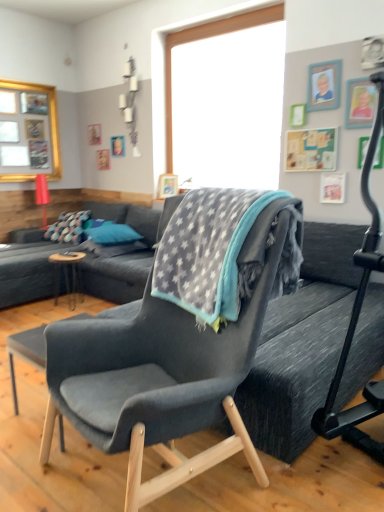
Question: Is gray fleece blanket at center to the left or to the right of brown wooden table at center in the image?

Choices:
 (A) right
 (B) left

Answer: (A)

Question: From the image's perspective, is gray fleece blanket at center positioned above or below brown wooden table at center?

Choices:
 (A) below
 (B) above

Answer: (B)

Question: Which of these objects is positioned farthest from the black rubber baby carriage at right?

Choices:
 (A) blue fabric pillow at center
 (B) dark gray fabric couch at left
 (C) velvet dark blue armchair at center
 (D) gray fleece blanket at center
 (E) gold-framed picture at upper left

Answer: (E)

Question: Based on their relative distances, which object is farther from the blue fabric pillow at center?

Choices:
 (A) black rubber baby carriage at right
 (B) gold-framed picture at upper left
 (C) velvet dark blue armchair at center
 (D) gray fleece blanket at center
 (E) dark gray fabric couch at left

Answer: (A)